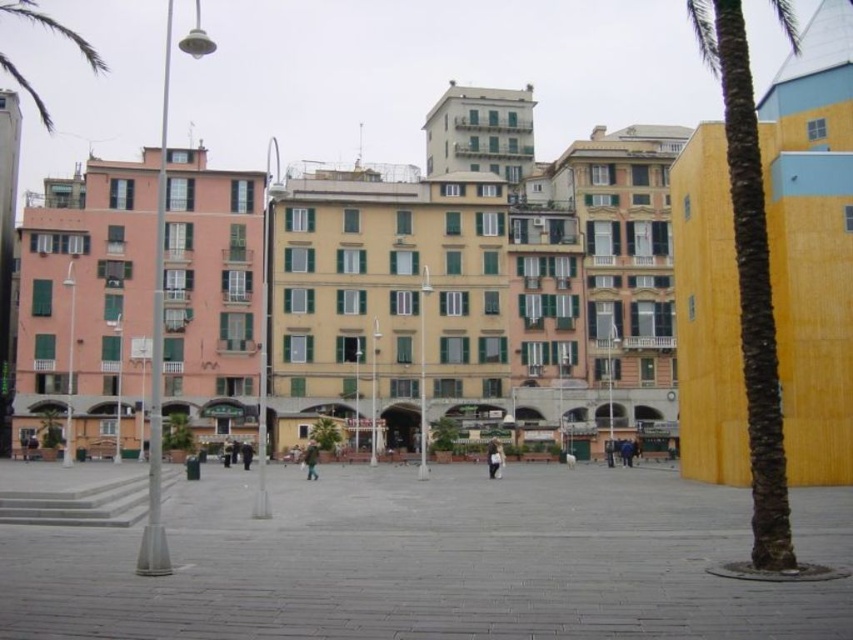
Question: Which object is positioned closest to the yellow matte palm tree at right?

Choices:
 (A) green fabric person at center
 (B) light brown leather jacket at center

Answer: (B)

Question: Is light brown leather jacket at center below green fabric person at center?

Choices:
 (A) yes
 (B) no

Answer: (B)

Question: Where is yellow matte palm tree at right located in relation to green fabric person at center in the image?

Choices:
 (A) left
 (B) right

Answer: (B)

Question: Which point is closer to the camera taking this photo?

Choices:
 (A) (753, 452)
 (B) (492, 445)

Answer: (A)

Question: Is yellow matte palm tree at right bigger than light brown leather jacket at center?

Choices:
 (A) no
 (B) yes

Answer: (B)

Question: Estimate the real-world distances between objects in this image. Which object is closer to the green fabric person at center?

Choices:
 (A) yellow matte palm tree at right
 (B) light brown leather jacket at center

Answer: (B)